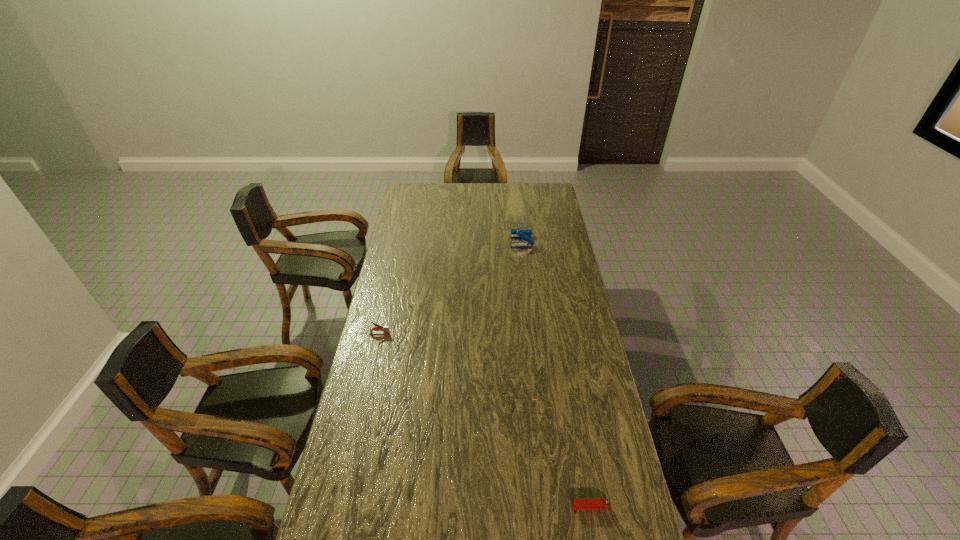
Locate an element on the screen. the tallest object is located at coordinates (525, 234).

The height and width of the screenshot is (540, 960). Identify the location of the farthest stapler. (525, 234).

Locate an element on the screen. This screenshot has width=960, height=540. the second farthest object is located at coordinates (385, 329).

In order to click on the leftmost object in this screenshot , I will do `click(385, 329)`.

Locate an element on the screen. The image size is (960, 540). spectacles is located at coordinates (529, 362).

You are a GUI agent. You are given a task and a screenshot of the screen. Output one action in this format:
    pyautogui.click(x=<x>, y=<y>)
    Task: Click on the third tallest object
    The image size is (960, 540).
    Given the screenshot: What is the action you would take?
    pyautogui.click(x=529, y=362)

Where is `the shortest stapler`? the shortest stapler is located at coordinates (585, 503).

At what (x,y) coordinates should I click in order to perform the action: click on the nearest stapler. Please return your answer as a coordinate pair (x, y). Looking at the image, I should click on (585, 503).

You are a GUI agent. You are given a task and a screenshot of the screen. Output one action in this format:
    pyautogui.click(x=<x>, y=<y>)
    Task: Click on the free space located 0.130m on the front of the tallest stapler
    This screenshot has height=540, width=960.
    Given the screenshot: What is the action you would take?
    pyautogui.click(x=524, y=264)

At what (x,y) coordinates should I click in order to perform the action: click on vacant space located 0.180m on the handle side of the third nearest object. Please return your answer as a coordinate pair (x, y). Looking at the image, I should click on (434, 334).